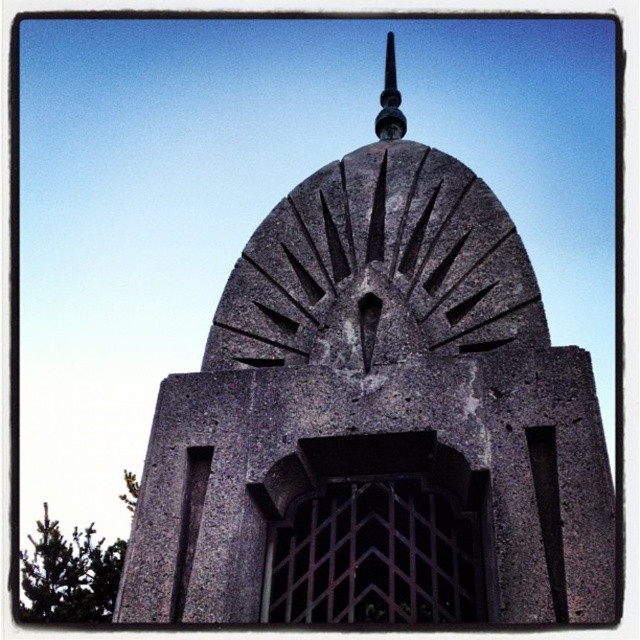
Question: In this image, where is gray stone tower at center located relative to polished metal spire at upper center?

Choices:
 (A) left
 (B) right

Answer: (A)

Question: Where is gray stone tower at center located in relation to polished metal spire at upper center in the image?

Choices:
 (A) right
 (B) left

Answer: (B)

Question: Which object is farther from the camera taking this photo?

Choices:
 (A) gray stone tower at center
 (B) polished metal spire at upper center

Answer: (B)

Question: Does gray stone tower at center appear over polished metal spire at upper center?

Choices:
 (A) yes
 (B) no

Answer: (B)

Question: Which object appears closest to the camera in this image?

Choices:
 (A) polished metal spire at upper center
 (B) gray stone tower at center

Answer: (B)

Question: Which point is farther from the camera taking this photo?

Choices:
 (A) pyautogui.click(x=429, y=586)
 (B) pyautogui.click(x=385, y=104)

Answer: (B)